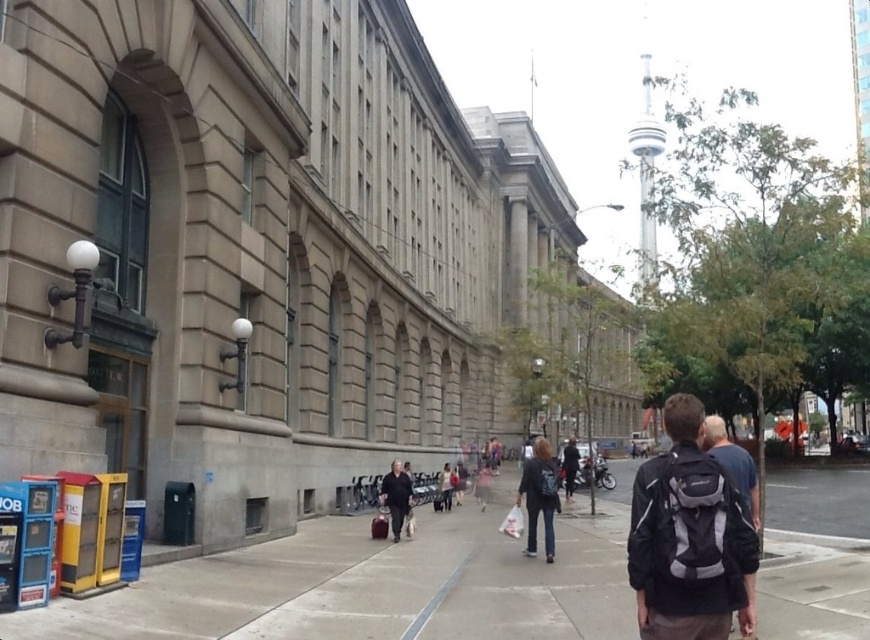
Question: Among these points, which one is nearest to the camera?

Choices:
 (A) (534, 538)
 (B) (726, 445)
 (C) (579, 557)

Answer: (B)

Question: Is gray concrete sidewalk at center to the left of dark blue jacket at center from the viewer's perspective?

Choices:
 (A) no
 (B) yes

Answer: (B)

Question: Among these objects, which one is farthest from the camera?

Choices:
 (A) gray concrete sidewalk at center
 (B) dark blue jacket at center
 (C) matte black backpack at center

Answer: (B)

Question: Which object is closer to the camera taking this photo?

Choices:
 (A) dark blue backpack at center
 (B) matte black backpack at center
 (C) dark gray fabric jacket at center
 (D) dark blue jacket at center

Answer: (B)

Question: Can you confirm if gray concrete sidewalk at center is positioned below dark blue jacket at center?

Choices:
 (A) yes
 (B) no

Answer: (B)

Question: Considering the relative positions of matte black backpack at center and dark blue backpack at center in the image provided, where is matte black backpack at center located with respect to dark blue backpack at center?

Choices:
 (A) above
 (B) below

Answer: (A)